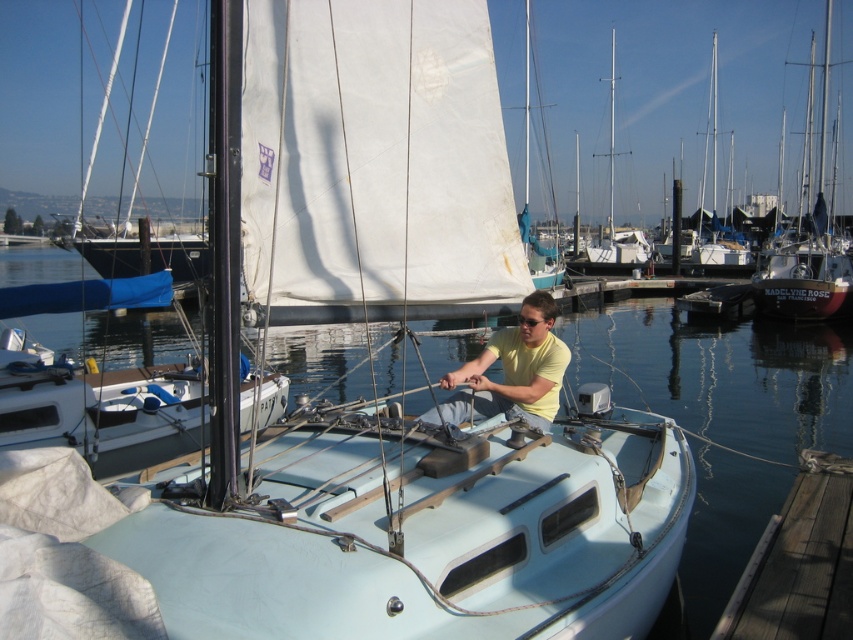
You are standing on the dock and looking at the clear water at center and the yellow matte shirt at center. Which object is closer to you?

The clear water at center is closer to the viewer than the yellow matte shirt at center.

You are standing at the point with coordinates (99, 406) in the marina scene. What object would you be standing on?

The point at coordinates (99, 406) is where the white matte sailboat at center is located, so you would be standing on the white matte sailboat at center.

You are standing at the dock and want to locate the point marked at coordinates (722, 374). According to the scene, where would this point be located?

The point marked at coordinates (722, 374) is on clear water at center.